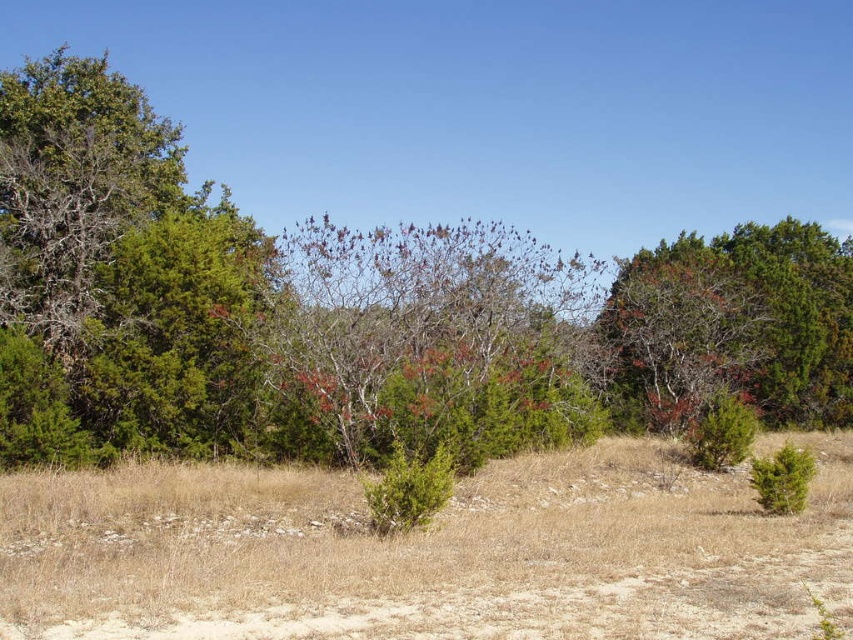
Is brown dry grass at center to the right of green textured bush at lower right from the viewer's perspective?

Incorrect, brown dry grass at center is not on the right side of green textured bush at lower right.

Is point (126, 499) farther from camera compared to point (793, 445)?

No, (126, 499) is in front of (793, 445).

Where is `brown dry grass at center`? brown dry grass at center is located at coordinates (426, 552).

Which is below, bare branches at upper right or green matte bush at center-right?

green matte bush at center-right is lower down.

Between point (675, 276) and point (738, 435), which one is positioned behind?

The point (675, 276) is behind.

The height and width of the screenshot is (640, 853). Identify the location of bare branches at upper right. (735, 324).

In the scene shown: Can you confirm if green matte tree at center is taller than green matte bush at center-right?

Indeed, green matte tree at center has a greater height compared to green matte bush at center-right.

Which is in front, point (270, 237) or point (730, 440)?

Point (730, 440)

Describe the element at coordinates (360, 312) in the screenshot. I see `green matte tree at center` at that location.

Where is `green matte tree at center`? This screenshot has width=853, height=640. green matte tree at center is located at coordinates (360, 312).